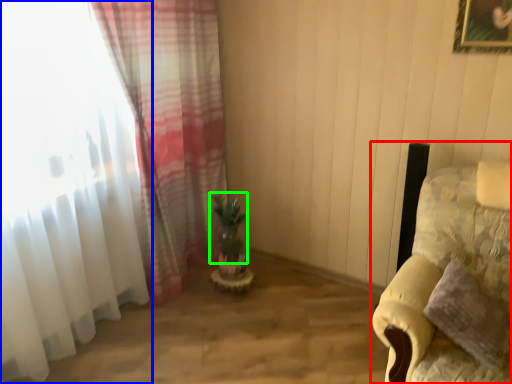
Question: Which object is the closest to the furniture (highlighted by a red box)? Choose among these: curtain (highlighted by a blue box) or plant (highlighted by a green box).

Choices:
 (A) curtain
 (B) plant

Answer: (B)